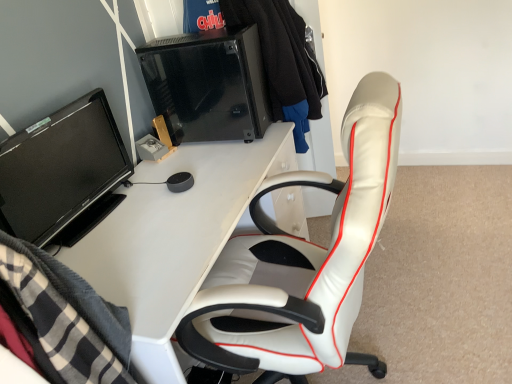
I want to click on vacant point above white glossy desk at center (from a real-world perspective), so click(x=152, y=209).